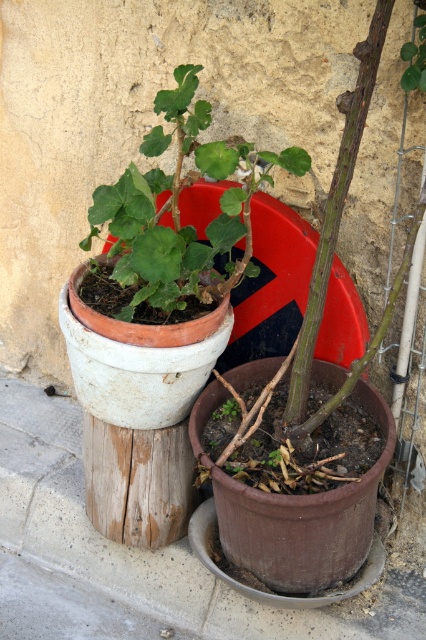
Question: Can you confirm if green matte pot at center is smaller than green matte leaf at center?

Choices:
 (A) no
 (B) yes

Answer: (A)

Question: Among these objects, which one is nearest to the camera?

Choices:
 (A) green matte plant at center
 (B) green matte pot at center

Answer: (B)

Question: From the image, what is the correct spatial relationship of green matte pot at center in relation to green matte leaf at center?

Choices:
 (A) left
 (B) right

Answer: (A)

Question: Estimate the real-world distances between objects in this image. Which object is closer to the green matte leaf at center?

Choices:
 (A) green matte plant at center
 (B) green matte pot at center

Answer: (B)

Question: In this image, where is green matte pot at center located relative to green matte plant at center?

Choices:
 (A) right
 (B) left

Answer: (B)

Question: Which point is farther to the camera?

Choices:
 (A) (408, 56)
 (B) (206, 234)
 (C) (229, 410)

Answer: (B)